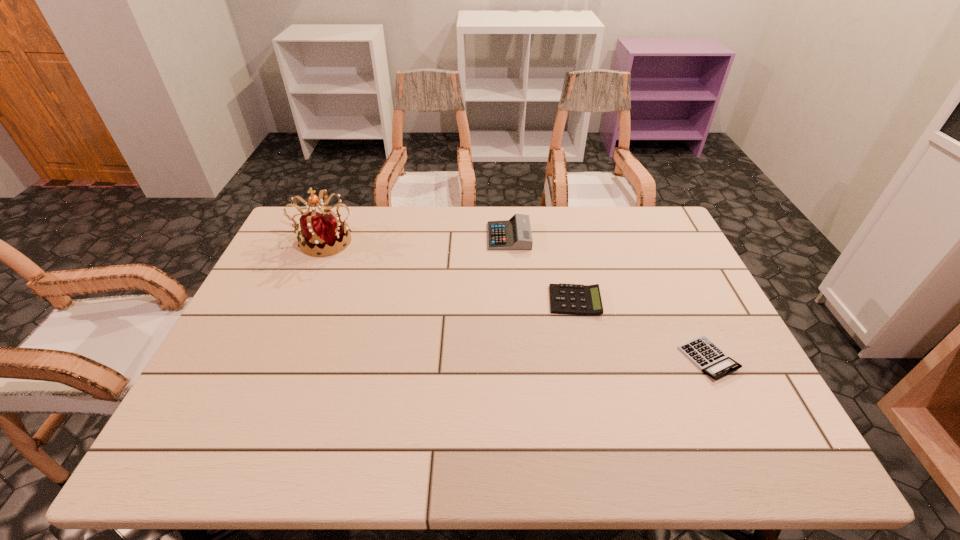
You are a GUI agent. You are given a task and a screenshot of the screen. Output one action in this format:
    pyautogui.click(x=<x>, y=<y>)
    Task: Click on the vacant region at the right edge
    
    Given the screenshot: What is the action you would take?
    pyautogui.click(x=666, y=305)

At what (x,y) coordinates should I click in order to perform the action: click on vacant space at the near left corner. Please return your answer as a coordinate pair (x, y). This screenshot has width=960, height=540. Looking at the image, I should click on (224, 438).

I want to click on vacant space at the far right corner of the desktop, so click(x=637, y=214).

Identify the location of empty location between the second shortest calculator and the farthest calculator. (541, 268).

Identify the location of vacant point located between the nearest object and the third shortest object. (609, 298).

At what (x,y) coordinates should I click in order to perform the action: click on free space that is in between the second calculator from right to left and the nearest calculator. Please return your answer as a coordinate pair (x, y). Looking at the image, I should click on (641, 329).

Identify the location of vacant area between the nearest object and the second tallest object. (609, 298).

The image size is (960, 540). What are the coordinates of `vacant space that's between the rightmost calculator and the leftmost calculator` in the screenshot? It's located at (609, 298).

This screenshot has width=960, height=540. Identify the location of free space between the nearest calculator and the second object from right to left. (641, 329).

This screenshot has width=960, height=540. What are the coordinates of `vacant space in between the shortest calculator and the tallest object` in the screenshot? It's located at (517, 299).